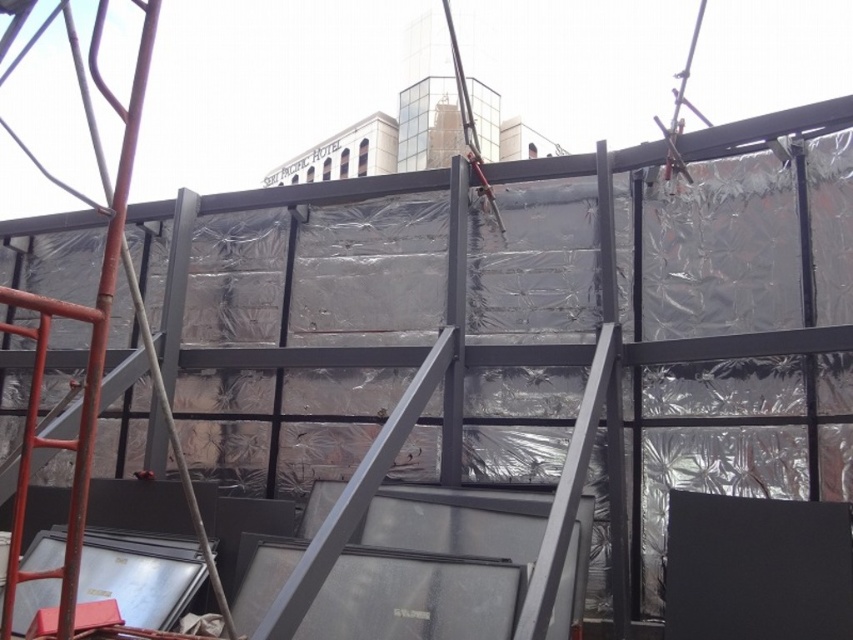
Question: Does red metal ladder at left have a smaller size compared to metal at center?

Choices:
 (A) yes
 (B) no

Answer: (B)

Question: Which point appears farthest from the camera in this image?

Choices:
 (A) 532,147
 (B) 16,534

Answer: (A)

Question: Where is red metal ladder at left located in relation to metal at center in the image?

Choices:
 (A) above
 (B) below

Answer: (B)

Question: Is red metal ladder at left smaller than metal at center?

Choices:
 (A) no
 (B) yes

Answer: (A)

Question: Which point appears closest to the camera in this image?

Choices:
 (A) (527, 154)
 (B) (135, 129)

Answer: (B)

Question: Which point appears farthest from the camera in this image?

Choices:
 (A) (30, 429)
 (B) (527, 145)

Answer: (B)